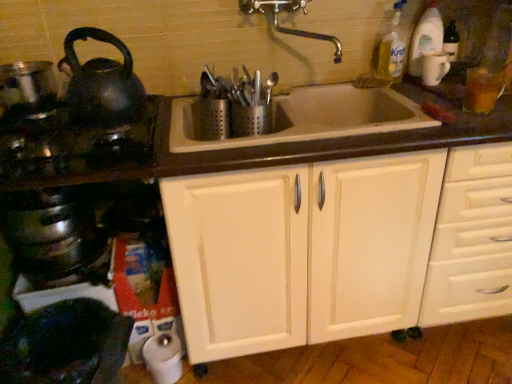
Image resolution: width=512 pixels, height=384 pixels. Find the location of `free space to the left of white glossy mug at upper right`. free space to the left of white glossy mug at upper right is located at coordinates (396, 84).